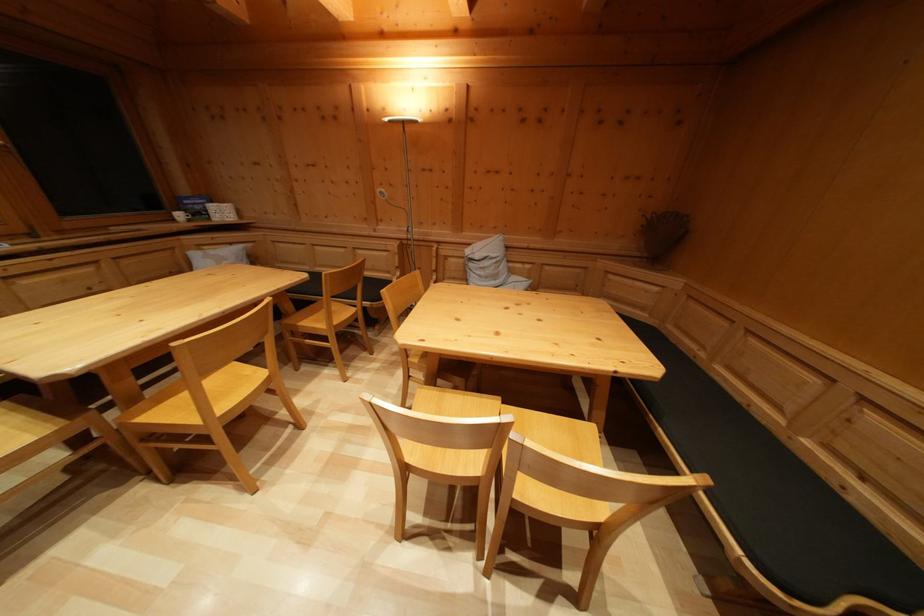
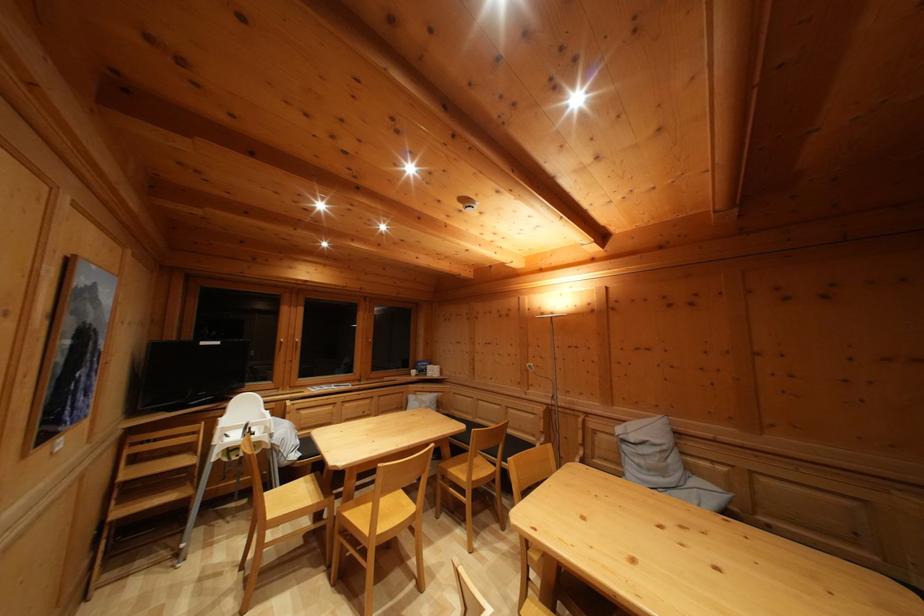
Where in the second image is the point corresponding to the point at 71,430 from the first image?

(329, 506)